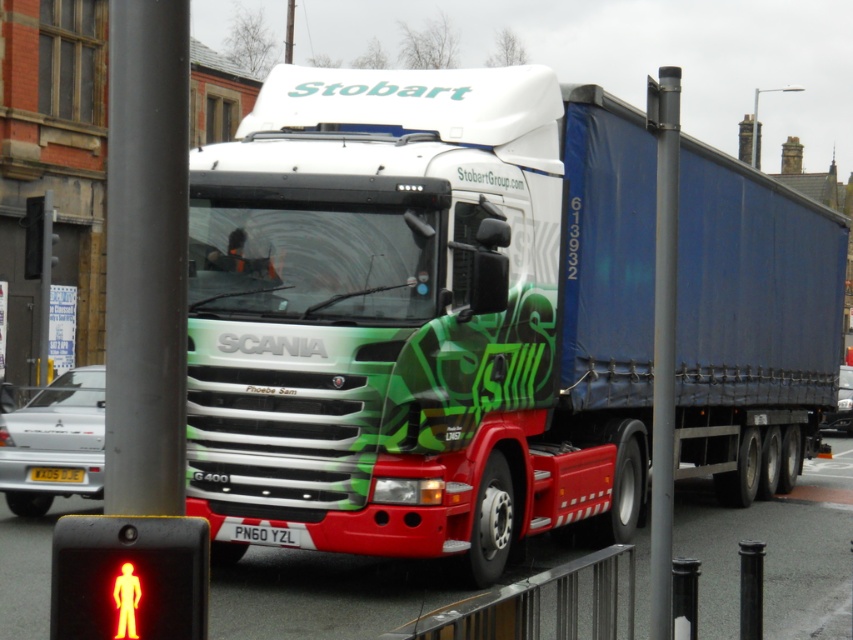
Question: Among these points, which one is nearest to the camera?

Choices:
 (A) (550, 500)
 (B) (74, 477)
 (C) (96, 547)

Answer: (C)

Question: Is green matte truck at center below yellow plastic pedestrian at lower left?

Choices:
 (A) yes
 (B) no

Answer: (B)

Question: Which of these objects is positioned closest to the green matte truck at center?

Choices:
 (A) yellow plastic pedestrian at lower left
 (B) yellow matte license plate at center

Answer: (B)

Question: Is yellow plastic pedestrian at lower left to the right of yellow matte license plate at center from the viewer's perspective?

Choices:
 (A) yes
 (B) no

Answer: (A)

Question: Which object is farther from the camera taking this photo?

Choices:
 (A) yellow matte license plate at center
 (B) yellow plastic pedestrian at lower left

Answer: (A)

Question: Observing the image, what is the correct spatial positioning of green matte truck at center in reference to yellow matte license plate at center?

Choices:
 (A) left
 (B) right

Answer: (B)